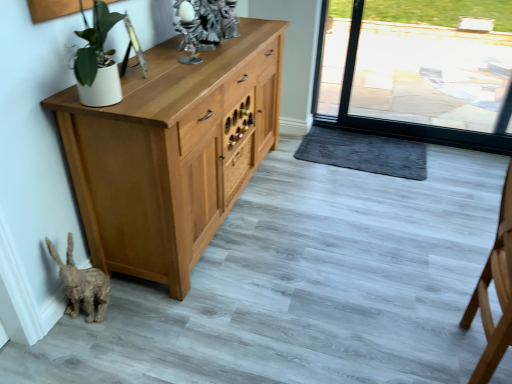
Question: Is wooden drawer at center taller or shorter than light brown wooden chair at right?

Choices:
 (A) short
 (B) tall

Answer: (A)

Question: From the image's perspective, is wooden drawer at center above or below light brown wooden chair at right?

Choices:
 (A) below
 (B) above

Answer: (B)

Question: Based on their relative distances, which object is farther from the dark gray plush doormat at lower center?

Choices:
 (A) wooden drawer at center
 (B) light brown wooden chair at right

Answer: (B)

Question: Which of these objects is positioned closest to the light brown wooden chair at right?

Choices:
 (A) wooden drawer at center
 (B) dark gray plush doormat at lower center

Answer: (B)